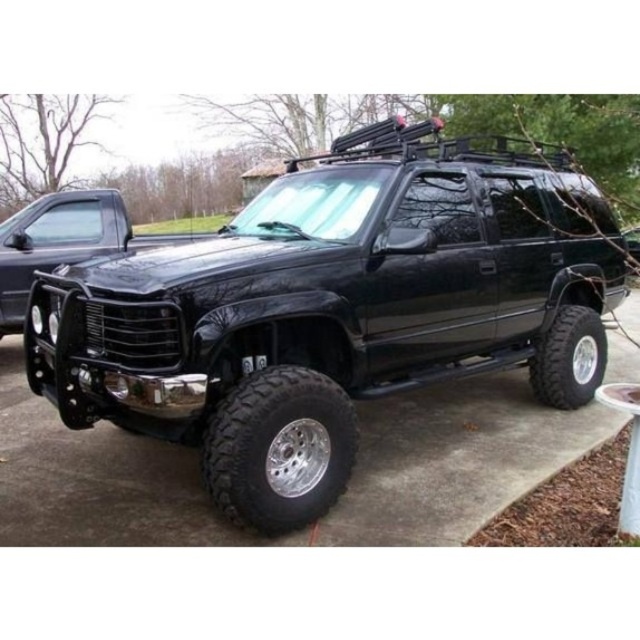
Who is lower down, black matte truck at center or black matte suv at center?

black matte truck at center is lower down.

Is black matte truck at center bigger than black matte suv at center?

Yes.

Looking at this image, who is more forward, (355, 371) or (634, 250)?

Point (355, 371) is more forward.

At what (x,y) coordinates should I click in order to perform the action: click on black matte truck at center. Please return your answer as a coordinate pair (x, y). Image resolution: width=640 pixels, height=640 pixels. Looking at the image, I should click on (324, 307).

Who is positioned more to the right, black rubber tire at right or black matte suv at center?

From the viewer's perspective, black matte suv at center appears more on the right side.

Who is shorter, black rubber tire at right or black matte suv at center?

With less height is black matte suv at center.

Image resolution: width=640 pixels, height=640 pixels. What do you see at coordinates (568, 358) in the screenshot?
I see `black rubber tire at right` at bounding box center [568, 358].

The image size is (640, 640). I want to click on black rubber tire at right, so pyautogui.click(x=568, y=358).

Who is shorter, black matte truck at center or black matte truck at left?

Standing shorter between the two is black matte truck at left.

Is point (273, 253) closer to camera compared to point (115, 205)?

Yes.

Between point (292, 371) and point (44, 220), which one is positioned behind?

Positioned behind is point (44, 220).

Find the location of `black matte truck at center`. black matte truck at center is located at coordinates (324, 307).